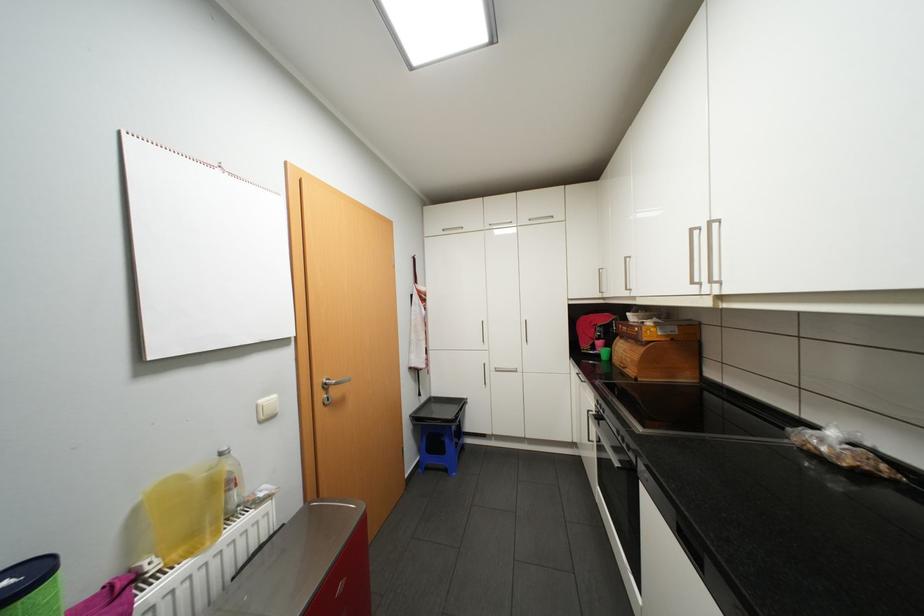
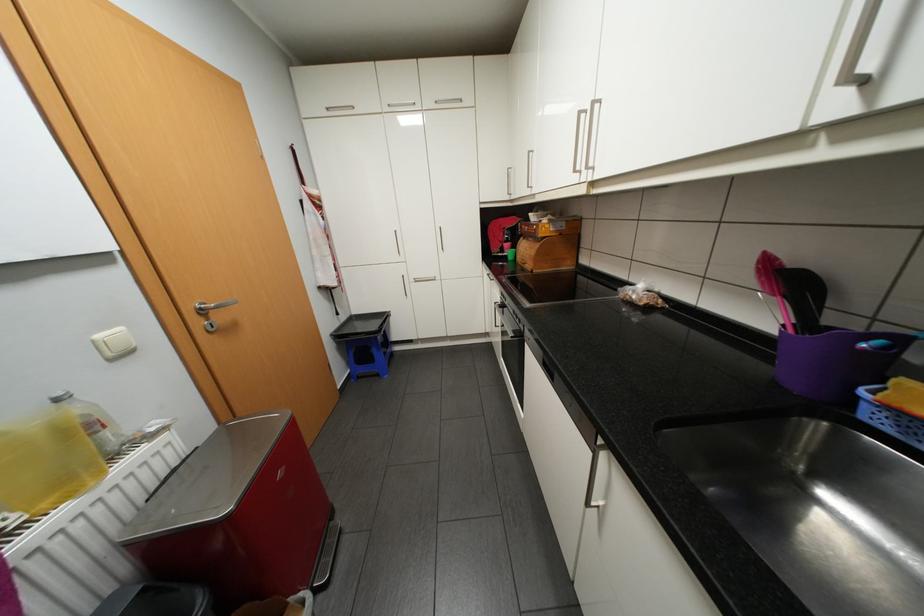
Where in the second image is the point corresponding to (x=629, y=337) from the first image?

(531, 237)